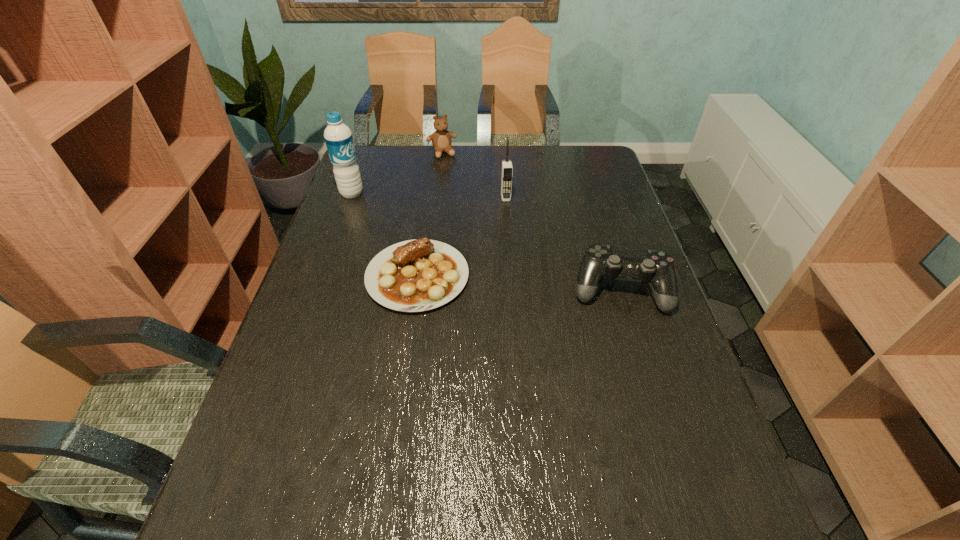
I want to click on free spot between the farthest object and the shortest object, so click(x=430, y=215).

Identify which object is the fourth closest to the teddy bear. Please provide its 2D coordinates. Your answer should be formatted as a tuple, i.e. [(x, y)], where the tuple contains the x and y coordinates of a point satisfying the conditions above.

[(656, 268)]

Find the location of a particular element. This screenshot has width=960, height=540. the fourth closest object to the steak is located at coordinates (441, 139).

What are the coordinates of `free space that satisfies the following two spatial constraints: 1. on the front side of the tallest object; 2. on the right side of the cellular telephone` in the screenshot? It's located at (350, 197).

Image resolution: width=960 pixels, height=540 pixels. In order to click on free space that satisfies the following two spatial constraints: 1. on the back side of the shortest object; 2. on the left side of the teddy bear in this screenshot , I will do `click(435, 153)`.

The width and height of the screenshot is (960, 540). What are the coordinates of `free location that satisfies the following two spatial constraints: 1. on the front side of the tallest object; 2. on the right side of the second object from right to left` in the screenshot? It's located at (350, 197).

Locate an element on the screen. This screenshot has height=540, width=960. free point that satisfies the following two spatial constraints: 1. on the front side of the steak; 2. on the right side of the control is located at coordinates (416, 289).